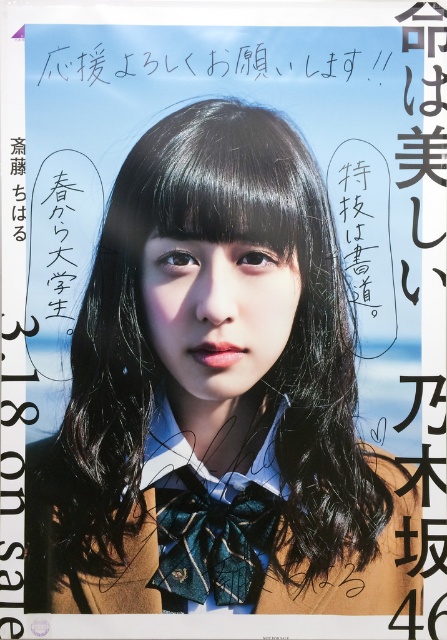
Consider the image. Is teal textured tie at center to the right of white handwritten text at upper center from the viewer's perspective?

In fact, teal textured tie at center is to the left of white handwritten text at upper center.

Between point (184, 580) and point (63, 61), which one is positioned in front?

Positioned in front is point (184, 580).

This screenshot has height=640, width=447. What are the coordinates of `teal textured tie at center` in the screenshot? It's located at (213, 541).

Does matte brown school uniform at center appear on the left side of white handwritten text at upper center?

No, matte brown school uniform at center is not to the left of white handwritten text at upper center.

Does matte brown school uniform at center appear on the right side of white handwritten text at upper center?

Correct, you'll find matte brown school uniform at center to the right of white handwritten text at upper center.

The width and height of the screenshot is (447, 640). Describe the element at coordinates (216, 397) in the screenshot. I see `matte brown school uniform at center` at that location.

You are a GUI agent. You are given a task and a screenshot of the screen. Output one action in this format:
    pyautogui.click(x=<x>, y=<y>)
    Task: Click on the matte brown school uniform at center
    The height and width of the screenshot is (640, 447).
    Given the screenshot: What is the action you would take?
    pyautogui.click(x=216, y=397)

Who is taller, matte black face at center or teal textured tie at center?

With more height is matte black face at center.

Can you confirm if matte black face at center is positioned below teal textured tie at center?

No.

Find the location of `matte black face at center`. matte black face at center is located at coordinates (216, 314).